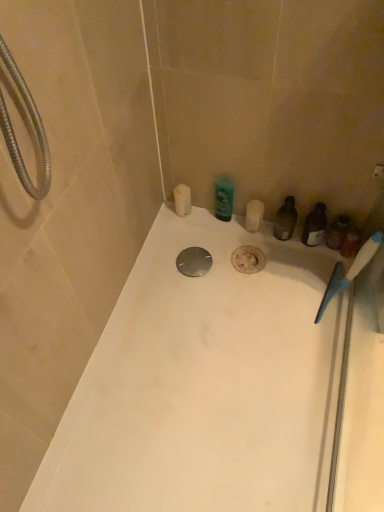
Find the location of a particular element. This screenshot has height=512, width=384. space that is in front of translucent plastic container at right, which is the 1th toiletry from right to left is located at coordinates (326, 288).